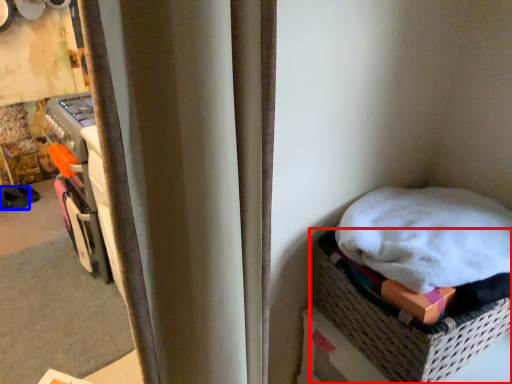
Question: Which of the following is the farthest to the observer, basket (highlighted by a red box) or footwear (highlighted by a blue box)?

Choices:
 (A) basket
 (B) footwear

Answer: (B)